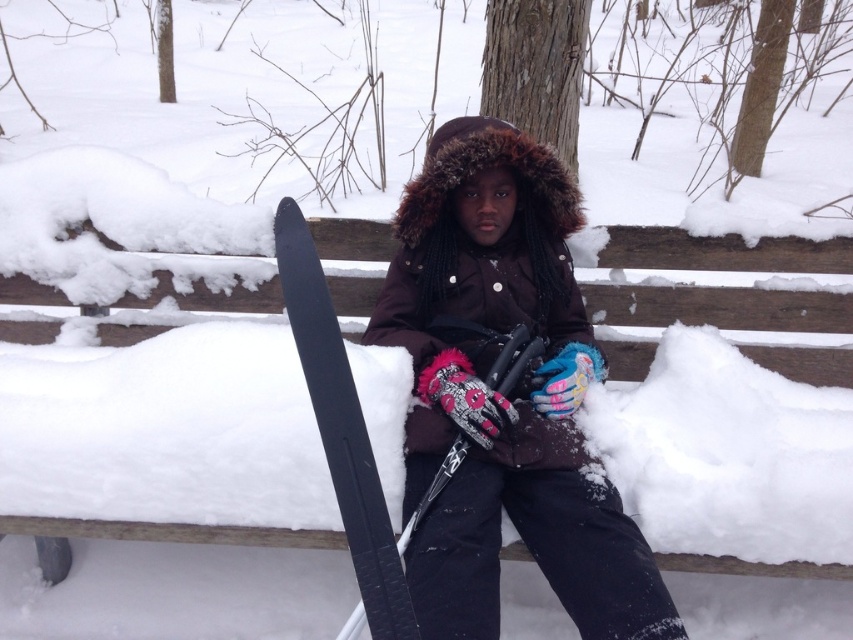
Question: Does dark brown fur-lined coat at center have a larger size compared to black matte ski at left?

Choices:
 (A) yes
 (B) no

Answer: (A)

Question: Is dark brown fur-lined coat at center above black matte ski at left?

Choices:
 (A) yes
 (B) no

Answer: (B)

Question: Can you confirm if dark brown fur-lined coat at center is positioned to the left of black matte ski at left?

Choices:
 (A) no
 (B) yes

Answer: (A)

Question: Which point is farther to the camera?

Choices:
 (A) black matte ski at left
 (B) dark brown fur-lined coat at center

Answer: (B)